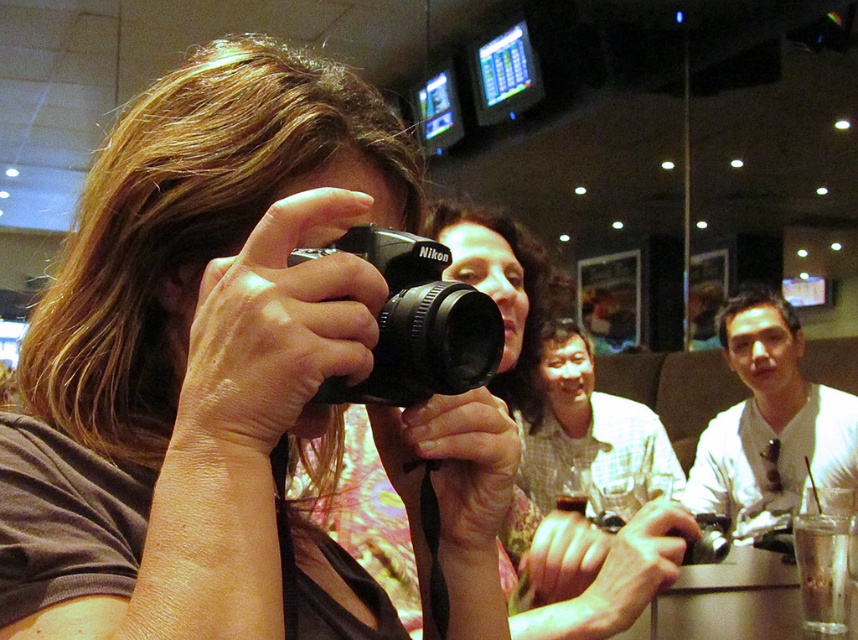
You are a photographer trying to capture the scene. You notice the floral fabric shirt at center and the black matte nikon camera at center. Which object is wider?

The floral fabric shirt at center is wider than the black matte nikon camera at center.

You are a photographer at the scene and want to capture a closeup of the floral fabric shirt at center. Given that your camera has a focal length of 50mm, what is the minimum distance you need to be from the point at (597, 572) to ensure the subject fills the frame?

To capture a closeup of the floral fabric shirt at center at a focal length of 50mm, you need to be within 1 meter of the point at (597, 572).

You are a photographer trying to capture a group photo of the two people wearing the floral fabric shirt at center and the white shirt at center. The minimum distance required for your camera to focus clearly is 1.2 meters. Will you be able to take a clear photo of both subjects at the same time?

The floral fabric shirt at center and white shirt at center are 1.18 meters apart, which is less than the required 1.2 meters for clear focus. Therefore, you may not be able to capture both subjects clearly in the same photo.